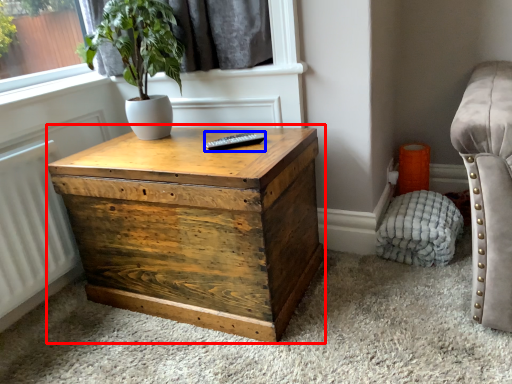
Question: Which of the following is the closest to the observer, nightstand (highlighted by a red box) or remote (highlighted by a blue box)?

Choices:
 (A) nightstand
 (B) remote

Answer: (A)